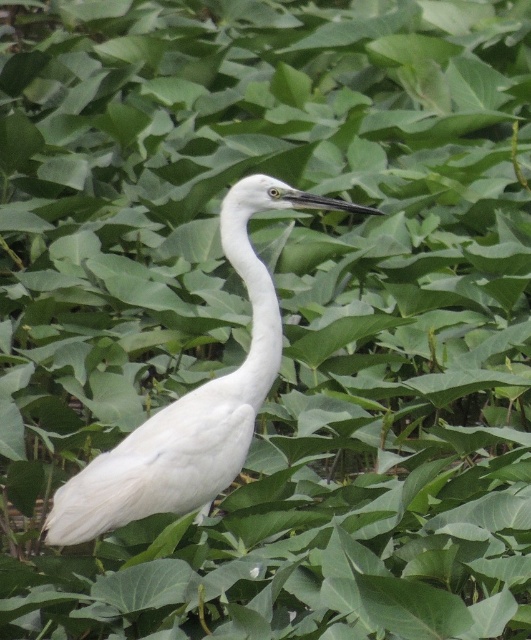
Which of these two, white feathered bird at center or white smooth neck at center, stands taller?

white feathered bird at center is taller.

Can you confirm if white feathered bird at center is positioned above white smooth neck at center?

Incorrect, white feathered bird at center is not positioned above white smooth neck at center.

At what (x,y) coordinates should I click in order to perform the action: click on white feathered bird at center. Please return your answer as a coordinate pair (x, y). The width and height of the screenshot is (531, 640). Looking at the image, I should click on (192, 403).